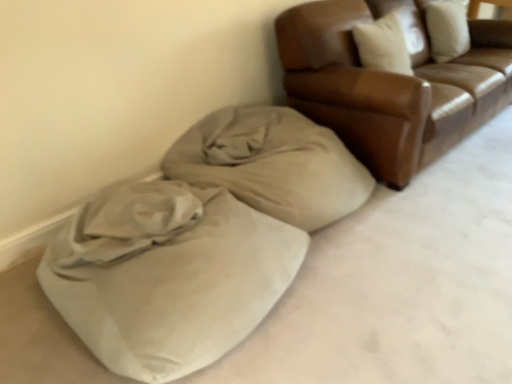
Describe the element at coordinates (200, 241) in the screenshot. The width and height of the screenshot is (512, 384). I see `suede-like beige bean bag at lower left` at that location.

The height and width of the screenshot is (384, 512). Describe the element at coordinates (391, 84) in the screenshot. I see `brown leather couch at upper right` at that location.

What do you see at coordinates (272, 164) in the screenshot? This screenshot has height=384, width=512. I see `beige fabric blanket at lower left` at bounding box center [272, 164].

Find the location of a particular element. Image resolution: width=512 pixels, height=384 pixels. suede-like beige bean bag at lower left is located at coordinates (200, 241).

Could you tell me if beige fabric blanket at lower left is turned towards brown leather couch at upper right?

No, beige fabric blanket at lower left is not turned towards brown leather couch at upper right.

Is beige fabric blanket at lower left far away from brown leather couch at upper right?

No, beige fabric blanket at lower left is in close proximity to brown leather couch at upper right.

From a real-world perspective, who is located lower, beige fabric blanket at lower left or brown leather couch at upper right?

From a 3D spatial view, beige fabric blanket at lower left is below.

Who is smaller, beige fabric blanket at lower left or brown leather couch at upper right?

With smaller size is beige fabric blanket at lower left.

Considering the sizes of objects brown leather couch at upper right and suede-like beige bean bag at lower left in the image provided, who is smaller, brown leather couch at upper right or suede-like beige bean bag at lower left?

suede-like beige bean bag at lower left is smaller.

Looking at their sizes, would you say brown leather couch at upper right is wider or thinner than suede-like beige bean bag at lower left?

Considering their sizes, brown leather couch at upper right looks slimmer than suede-like beige bean bag at lower left.

Is brown leather couch at upper right not close to suede-like beige bean bag at lower left?

No, brown leather couch at upper right is not far from suede-like beige bean bag at lower left.

Considering the positions of objects brown leather couch at upper right and suede-like beige bean bag at lower left in the image provided, who is more to the left, brown leather couch at upper right or suede-like beige bean bag at lower left?

Positioned to the left is suede-like beige bean bag at lower left.

Is brown leather couch at upper right next to beige fabric blanket at lower left?

No.

From a real-world perspective, is brown leather couch at upper right positioned above or below beige fabric blanket at lower left?

From a real-world perspective, brown leather couch at upper right is physically above beige fabric blanket at lower left.

Considering the relative sizes of brown leather couch at upper right and beige fabric blanket at lower left in the image provided, is brown leather couch at upper right bigger than beige fabric blanket at lower left?

Yes.

Considering the sizes of objects brown leather couch at upper right and beige fabric blanket at lower left in the image provided, who is wider, brown leather couch at upper right or beige fabric blanket at lower left?

Wider between the two is brown leather couch at upper right.

Does beige fabric blanket at lower left turn towards suede-like beige bean bag at lower left?

No, beige fabric blanket at lower left is not facing towards suede-like beige bean bag at lower left.

From the image's perspective, is beige fabric blanket at lower left above suede-like beige bean bag at lower left?

Yes, from the image's perspective, beige fabric blanket at lower left is over suede-like beige bean bag at lower left.

Is beige fabric blanket at lower left far from suede-like beige bean bag at lower left?

No.

Locate an element on the screen. The height and width of the screenshot is (384, 512). blanket above the suede-like beige bean bag at lower left (from a real-world perspective) is located at coordinates (272, 164).

Can you confirm if suede-like beige bean bag at lower left is shorter than brown leather couch at upper right?

Yes, suede-like beige bean bag at lower left is shorter than brown leather couch at upper right.

Could you tell me if suede-like beige bean bag at lower left is turned towards brown leather couch at upper right?

No, suede-like beige bean bag at lower left is not oriented towards brown leather couch at upper right.

How many degrees apart are the facing directions of suede-like beige bean bag at lower left and brown leather couch at upper right?

The facing directions of suede-like beige bean bag at lower left and brown leather couch at upper right are 0.000353 degrees apart.

Which object is further away from the camera taking this photo, suede-like beige bean bag at lower left or brown leather couch at upper right?

Positioned behind is brown leather couch at upper right.

Is suede-like beige bean bag at lower left smaller than beige fabric blanket at lower left?

Actually, suede-like beige bean bag at lower left might be larger than beige fabric blanket at lower left.

Considering the positions of objects suede-like beige bean bag at lower left and beige fabric blanket at lower left in the image provided, who is more to the right, suede-like beige bean bag at lower left or beige fabric blanket at lower left?

beige fabric blanket at lower left is more to the right.

From the picture: Is suede-like beige bean bag at lower left inside or outside of beige fabric blanket at lower left?

suede-like beige bean bag at lower left exists outside the volume of beige fabric blanket at lower left.

Which is less distant, (163,239) or (232,116)?

Point (163,239)

Image resolution: width=512 pixels, height=384 pixels. What are the coordinates of `blanket that is on the left side of brown leather couch at upper right` in the screenshot? It's located at (272, 164).

Where is `studio couch above the suede-like beige bean bag at lower left (from the image's perspective)`? The height and width of the screenshot is (384, 512). studio couch above the suede-like beige bean bag at lower left (from the image's perspective) is located at coordinates (391, 84).

From the image, which object appears to be nearer to beige fabric blanket at lower left, brown leather couch at upper right or suede-like beige bean bag at lower left?

suede-like beige bean bag at lower left.

Estimate the real-world distances between objects in this image. Which object is further from suede-like beige bean bag at lower left, brown leather couch at upper right or beige fabric blanket at lower left?

brown leather couch at upper right.

Looking at the image, which one is located closer to brown leather couch at upper right, beige fabric blanket at lower left or suede-like beige bean bag at lower left?

beige fabric blanket at lower left.

When comparing their distances from beige fabric blanket at lower left, does suede-like beige bean bag at lower left or brown leather couch at upper right seem further?

Among the two, brown leather couch at upper right is located further to beige fabric blanket at lower left.

From the image, which object appears to be farther from suede-like beige bean bag at lower left, beige fabric blanket at lower left or brown leather couch at upper right?

The object further to suede-like beige bean bag at lower left is brown leather couch at upper right.

From the picture: Estimate the real-world distances between objects in this image. Which object is closer to brown leather couch at upper right, suede-like beige bean bag at lower left or beige fabric blanket at lower left?

beige fabric blanket at lower left is closer to brown leather couch at upper right.

Identify the location of blanket located between suede-like beige bean bag at lower left and brown leather couch at upper right in the left-right direction. (272, 164).